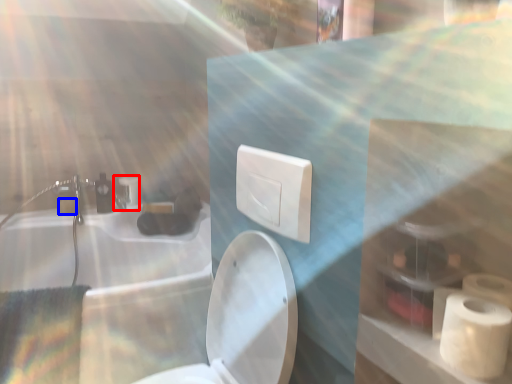
Question: Which object appears closest to the camera in this image, faucet (highlighted by a red box) or toilet paper (highlighted by a blue box)?

Choices:
 (A) faucet
 (B) toilet paper

Answer: (B)